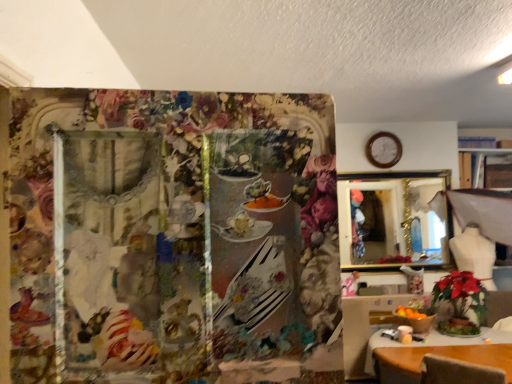
Question: Is wooden table at lower right, arranged as the second table when viewed from the back, to the right of gold-framed mirror at upper right from the viewer's perspective?

Choices:
 (A) no
 (B) yes

Answer: (A)

Question: Can you confirm if wooden table at lower right, arranged as the second table when viewed from the left, is taller than gold-framed mirror at upper right?

Choices:
 (A) yes
 (B) no

Answer: (B)

Question: Is wooden table at lower right, arranged as the second table when viewed from the left, wider than gold-framed mirror at upper right?

Choices:
 (A) yes
 (B) no

Answer: (A)

Question: Is wooden table at lower right, which is the first table from front to back, looking in the opposite direction of gold-framed mirror at upper right?

Choices:
 (A) no
 (B) yes

Answer: (A)

Question: Is wooden table at lower right, arranged as the second table when viewed from the left, placed right next to gold-framed mirror at upper right?

Choices:
 (A) yes
 (B) no

Answer: (B)

Question: Is gold-framed mirror at upper right inside or outside of wooden table at lower right, placed as the 1th table when sorted from right to left?

Choices:
 (A) inside
 (B) outside

Answer: (B)

Question: Is point (419, 198) closer or farther from the camera than point (374, 344)?

Choices:
 (A) closer
 (B) farther

Answer: (B)

Question: From the image's perspective, is gold-framed mirror at upper right positioned above or below wooden table at lower right, arranged as the second table when viewed from the left?

Choices:
 (A) below
 (B) above

Answer: (B)

Question: Looking at the image, does gold-framed mirror at upper right seem bigger or smaller compared to wooden table at lower right, which is the first table from front to back?

Choices:
 (A) small
 (B) big

Answer: (A)

Question: From a real-world perspective, is wooden table at lower right, which is the first table from front to back, positioned above or below wooden clock at upper right?

Choices:
 (A) below
 (B) above

Answer: (A)

Question: Is wooden table at lower right, placed as the 1th table when sorted from right to left, to the left or to the right of wooden clock at upper right in the image?

Choices:
 (A) right
 (B) left

Answer: (A)

Question: Is wooden table at lower right, arranged as the second table when viewed from the back, spatially inside wooden clock at upper right, or outside of it?

Choices:
 (A) inside
 (B) outside

Answer: (B)

Question: From the image's perspective, is wooden table at lower right, arranged as the second table when viewed from the back, located above or below wooden clock at upper right?

Choices:
 (A) below
 (B) above

Answer: (A)

Question: Is gold-framed mirror at upper right taller or shorter than wooden table at lower right, which is the first table in left-to-right order?

Choices:
 (A) short
 (B) tall

Answer: (B)

Question: Is gold-framed mirror at upper right to the left or to the right of wooden table at lower right, which is the second table in front-to-back order, in the image?

Choices:
 (A) left
 (B) right

Answer: (B)